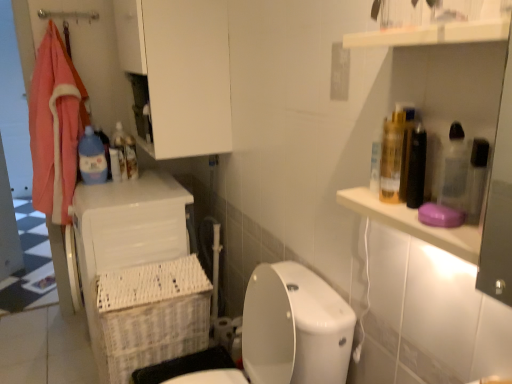
Question: Does white plastic laundry basket at lower left have a larger size compared to blue plastic bottle at left?

Choices:
 (A) no
 (B) yes

Answer: (B)

Question: Considering the relative sizes of white plastic laundry basket at lower left and blue plastic bottle at left in the image provided, is white plastic laundry basket at lower left smaller than blue plastic bottle at left?

Choices:
 (A) yes
 (B) no

Answer: (B)

Question: Considering the relative positions of white plastic laundry basket at lower left and blue plastic bottle at left in the image provided, is white plastic laundry basket at lower left in front of blue plastic bottle at left?

Choices:
 (A) no
 (B) yes

Answer: (B)

Question: From the image's perspective, would you say white plastic laundry basket at lower left is positioned over blue plastic bottle at left?

Choices:
 (A) yes
 (B) no

Answer: (B)

Question: Does white plastic laundry basket at lower left lie behind blue plastic bottle at left?

Choices:
 (A) no
 (B) yes

Answer: (A)

Question: Would you say white glossy toilet at lower center is to the left or to the right of white plastic laundry basket at lower left in the picture?

Choices:
 (A) left
 (B) right

Answer: (B)

Question: Would you say white glossy toilet at lower center is inside or outside white plastic laundry basket at lower left?

Choices:
 (A) inside
 (B) outside

Answer: (B)

Question: In terms of height, does white glossy toilet at lower center look taller or shorter compared to white plastic laundry basket at lower left?

Choices:
 (A) tall
 (B) short

Answer: (B)

Question: From a real-world perspective, is white glossy toilet at lower center above or below white plastic laundry basket at lower left?

Choices:
 (A) below
 (B) above

Answer: (B)

Question: Considering the relative positions of white wicker basket at lower left and white matte cabinet at upper center in the image provided, is white wicker basket at lower left to the left or to the right of white matte cabinet at upper center?

Choices:
 (A) right
 (B) left

Answer: (B)

Question: Choose the correct answer: Is white wicker basket at lower left inside white matte cabinet at upper center or outside it?

Choices:
 (A) outside
 (B) inside

Answer: (A)

Question: Is white wicker basket at lower left taller or shorter than white matte cabinet at upper center?

Choices:
 (A) tall
 (B) short

Answer: (B)

Question: From the image's perspective, is white wicker basket at lower left positioned above or below white matte cabinet at upper center?

Choices:
 (A) below
 (B) above

Answer: (A)

Question: From the image's perspective, is white plastic laundry basket at lower left located above or below white glossy toilet at lower center?

Choices:
 (A) below
 (B) above

Answer: (B)

Question: Is white plastic laundry basket at lower left wider or thinner than white glossy toilet at lower center?

Choices:
 (A) thin
 (B) wide

Answer: (A)